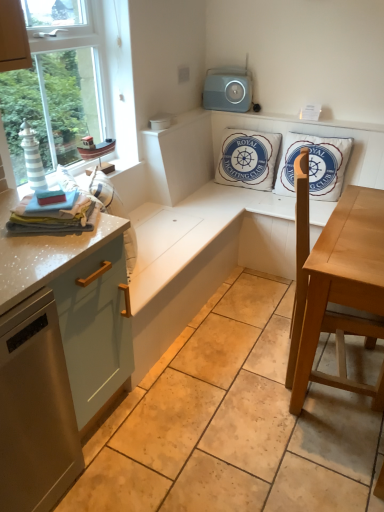
Describe the element at coordinates (314, 165) in the screenshot. I see `white cotton cushion at upper right, marked as the 1th pillow in a right-to-left arrangement` at that location.

Image resolution: width=384 pixels, height=512 pixels. Describe the element at coordinates (247, 158) in the screenshot. I see `white cotton cushion at upper center, which is the 1th pillow in left-to-right order` at that location.

What are the coordinates of `satin silver dishwasher at lower left` in the screenshot? It's located at (35, 408).

In order to face light brown wooden table at center, should I rotate leftwards or rightwards?

To face it directly, rotate right by 19.345 degrees.

Locate an element on the screen. This screenshot has height=512, width=384. white cotton cushion at upper right, which is counted as the 2th pillow, starting from the left is located at coordinates (314, 165).

From a real-world perspective, which is physically below, white cotton cushion at upper center, which is counted as the second pillow, starting from the right, or light brown wooden table at center?

In real-world perspective, light brown wooden table at center is lower.

Based on the photo, from the image's perspective, is white cotton cushion at upper center, which is counted as the second pillow, starting from the right, on light brown wooden table at center?

Correct, white cotton cushion at upper center, which is counted as the second pillow, starting from the right, appears higher than light brown wooden table at center in the image.

Does point (268, 136) come farther from viewer compared to point (356, 331)?

Yes, point (268, 136) is farther from viewer.

Which of these two, gray plastic speaker at upper center or matte light blue cabinet at left, stands taller?

With more height is matte light blue cabinet at left.

Is gray plastic speaker at upper center further to camera compared to matte light blue cabinet at left?

Yes, gray plastic speaker at upper center is behind matte light blue cabinet at left.

Can you see gray plastic speaker at upper center touching matte light blue cabinet at left?

No, gray plastic speaker at upper center is not touching matte light blue cabinet at left.

Measure the distance between gray plastic speaker at upper center and white cotton cushion at upper center, which is the 1th pillow in left-to-right order.

They are 13.67 inches apart.

Which is more distant, (230, 70) or (274, 160)?

Point (230, 70)

Is white cotton cushion at upper center, which is counted as the second pillow, starting from the right, surrounded by gray plastic speaker at upper center?

No, white cotton cushion at upper center, which is counted as the second pillow, starting from the right, is not inside gray plastic speaker at upper center.

From a real-world perspective, which is physically above, gray plastic speaker at upper center or white cotton cushion at upper center, which is the 1th pillow in left-to-right order?

gray plastic speaker at upper center, from a real-world perspective.

Does satin silver dishwasher at lower left have a greater width compared to white cotton cushion at upper right, which is counted as the 2th pillow, starting from the left?

Yes, satin silver dishwasher at lower left is wider than white cotton cushion at upper right, which is counted as the 2th pillow, starting from the left.

Is satin silver dishwasher at lower left outside of white cotton cushion at upper right, which is counted as the 2th pillow, starting from the left?

Yes, satin silver dishwasher at lower left is outside of white cotton cushion at upper right, which is counted as the 2th pillow, starting from the left.

Is satin silver dishwasher at lower left turned away from white cotton cushion at upper right, which is counted as the 2th pillow, starting from the left?

No, satin silver dishwasher at lower left is not facing the opposite direction of white cotton cushion at upper right, which is counted as the 2th pillow, starting from the left.

Consider the image. From the image's perspective, which object appears higher, white cotton cushion at upper center, which is the 1th pillow in left-to-right order, or gray plastic speaker at upper center?

gray plastic speaker at upper center, from the image's perspective.

Considering the sizes of objects white cotton cushion at upper center, which is the 1th pillow in left-to-right order, and gray plastic speaker at upper center in the image provided, who is bigger, white cotton cushion at upper center, which is the 1th pillow in left-to-right order, or gray plastic speaker at upper center?

white cotton cushion at upper center, which is the 1th pillow in left-to-right order.

Between white cotton cushion at upper center, which is counted as the second pillow, starting from the right, and gray plastic speaker at upper center, which one has larger width?

white cotton cushion at upper center, which is counted as the second pillow, starting from the right.

Is white cotton cushion at upper center, which is the 1th pillow in left-to-right order, taller than gray plastic speaker at upper center?

Correct, white cotton cushion at upper center, which is the 1th pillow in left-to-right order, is much taller as gray plastic speaker at upper center.

From a real-world perspective, who is located higher, matte light blue cabinet at left or white cotton cushion at upper center, which is the 1th pillow in left-to-right order?

white cotton cushion at upper center, which is the 1th pillow in left-to-right order, is physically above.

Is matte light blue cabinet at left closer to camera compared to white cotton cushion at upper center, which is counted as the second pillow, starting from the right?

That is True.

Between matte light blue cabinet at left and white cotton cushion at upper center, which is counted as the second pillow, starting from the right, which one has smaller width?

white cotton cushion at upper center, which is counted as the second pillow, starting from the right.

From the picture: Is matte light blue cabinet at left facing away from white cotton cushion at upper center, which is counted as the second pillow, starting from the right?

matte light blue cabinet at left does not have its back to white cotton cushion at upper center, which is counted as the second pillow, starting from the right.

Is white cotton cushion at upper center, which is the 1th pillow in left-to-right order, bigger than matte light blue cabinet at left?

Incorrect, white cotton cushion at upper center, which is the 1th pillow in left-to-right order, is not larger than matte light blue cabinet at left.

From the image's perspective, which one is positioned lower, white cotton cushion at upper center, which is counted as the second pillow, starting from the right, or matte light blue cabinet at left?

From the image's view, matte light blue cabinet at left is below.

From the image's perspective, which pillow is the 2nd one above the matte light blue cabinet at left? Please provide its 2D coordinates.

[(247, 158)]

At what (x,y) coordinates should I click in order to perform the action: click on table in front of the white cotton cushion at upper center, which is counted as the second pillow, starting from the right. Please return your answer as a coordinate pair (x, y). Looking at the image, I should click on point(344,287).

Identify the location of speaker that is above the matte light blue cabinet at left (from the image's perspective). (228, 89).

Consider the image. From the image, which object appears to be nearer to satin silver dishwasher at lower left, light brown wooden table at center or white cotton cushion at upper right, marked as the 1th pillow in a right-to-left arrangement?

light brown wooden table at center is closer to satin silver dishwasher at lower left.

Estimate the real-world distances between objects in this image. Which object is closer to white cotton cushion at upper center, which is counted as the second pillow, starting from the right, light brown wooden table at center or white cotton cushion at upper right, which is counted as the 2th pillow, starting from the left?

Based on the image, white cotton cushion at upper right, which is counted as the 2th pillow, starting from the left, appears to be nearer to white cotton cushion at upper center, which is counted as the second pillow, starting from the right.

Looking at the image, which one is located closer to matte light blue cabinet at left, gray plastic speaker at upper center or white cotton cushion at upper center, which is counted as the second pillow, starting from the right?

Among the two, white cotton cushion at upper center, which is counted as the second pillow, starting from the right, is located nearer to matte light blue cabinet at left.

Based on their spatial positions, is satin silver dishwasher at lower left or light brown wooden table at center closer to white cotton cushion at upper right, marked as the 1th pillow in a right-to-left arrangement?

The object closer to white cotton cushion at upper right, marked as the 1th pillow in a right-to-left arrangement, is light brown wooden table at center.

When comparing their distances from satin silver dishwasher at lower left, does white cotton cushion at upper right, which is counted as the 2th pillow, starting from the left, or light brown wooden table at center seem closer?

light brown wooden table at center.

Considering their positions, is matte light blue cabinet at left positioned closer to gray plastic speaker at upper center than white cotton cushion at upper right, marked as the 1th pillow in a right-to-left arrangement?

white cotton cushion at upper right, marked as the 1th pillow in a right-to-left arrangement, is closer to gray plastic speaker at upper center.

Which object lies further to the anchor point matte light blue cabinet at left, light brown wooden table at center or gray plastic speaker at upper center?

gray plastic speaker at upper center.

Which object lies further to the anchor point satin silver dishwasher at lower left, gray plastic speaker at upper center or white cotton cushion at upper center, which is the 1th pillow in left-to-right order?

gray plastic speaker at upper center is further to satin silver dishwasher at lower left.

I want to click on cabinetry between satin silver dishwasher at lower left and white cotton cushion at upper center, which is the 1th pillow in left-to-right order, from front to back, so click(x=56, y=352).

This screenshot has width=384, height=512. Identify the location of table located between satin silver dishwasher at lower left and white cotton cushion at upper right, which is counted as the 2th pillow, starting from the left, in the left-right direction. (344, 287).

You are a GUI agent. You are given a task and a screenshot of the screen. Output one action in this format:
    pyautogui.click(x=<x>, y=<y>)
    Task: Click on the table between matte light blue cabinet at left and white cotton cushion at upper right, marked as the 1th pillow in a right-to-left arrangement
    This screenshot has width=384, height=512.
    Given the screenshot: What is the action you would take?
    pyautogui.click(x=344, y=287)

You are a GUI agent. You are given a task and a screenshot of the screen. Output one action in this format:
    pyautogui.click(x=<x>, y=<y>)
    Task: Click on the table between satin silver dishwasher at lower left and white cotton cushion at upper center, which is the 1th pillow in left-to-right order, along the z-axis
    
    Given the screenshot: What is the action you would take?
    pyautogui.click(x=344, y=287)